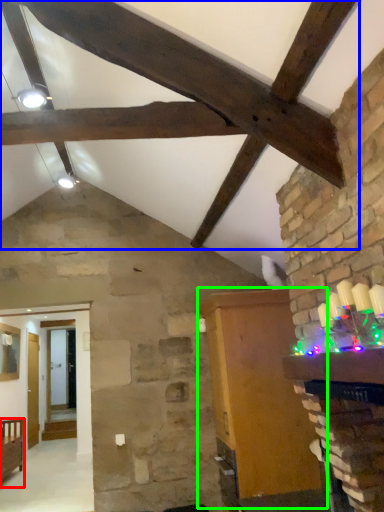
Question: Which is nearer to the furniture (highlighted by a red box)? exhaust hood (highlighted by a blue box) or furniture (highlighted by a green box).

Choices:
 (A) exhaust hood
 (B) furniture

Answer: (B)